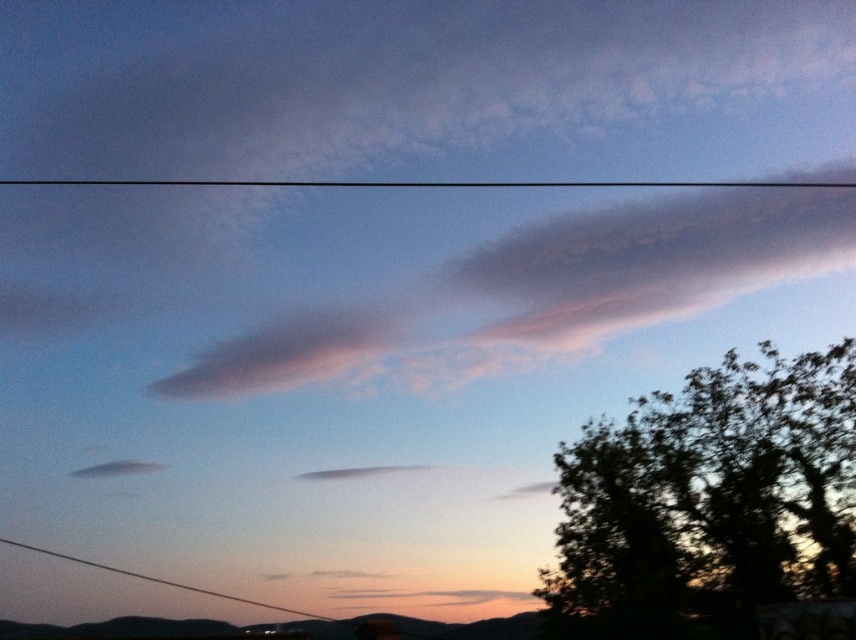
Question: Can you confirm if pinkish-gray cloud at upper center is thinner than black wire at lower center?

Choices:
 (A) no
 (B) yes

Answer: (A)

Question: Which point appears closest to the camera in this image?

Choices:
 (A) (682, 486)
 (B) (370, 353)
 (C) (215, 596)

Answer: (A)

Question: Is dark green leafy tree at right further to camera compared to pinkish-gray cloud at upper center?

Choices:
 (A) yes
 (B) no

Answer: (B)

Question: Which point appears closest to the camera in this image?

Choices:
 (A) (765, 611)
 (B) (642, 234)

Answer: (A)

Question: Is dark green leafy tree at right to the left of pinkish-gray cloud at upper center from the viewer's perspective?

Choices:
 (A) yes
 (B) no

Answer: (B)

Question: Which of the following is the closest to the observer?

Choices:
 (A) (684, 545)
 (B) (592, 280)
 (C) (155, 580)

Answer: (A)